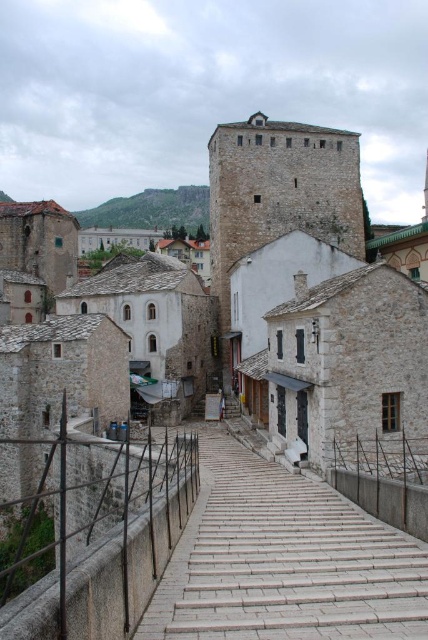
Consider the image. Is white stone tower at center to the right of green stone cliff at upper center from the viewer's perspective?

Indeed, white stone tower at center is positioned on the right side of green stone cliff at upper center.

Is white stone tower at center bigger than green stone cliff at upper center?

No.

Locate an element on the screen. The height and width of the screenshot is (640, 428). white stone tower at center is located at coordinates (278, 196).

Is white stone steps at center bigger than green stone cliff at upper center?

Actually, white stone steps at center might be smaller than green stone cliff at upper center.

The image size is (428, 640). What do you see at coordinates (284, 560) in the screenshot? I see `white stone steps at center` at bounding box center [284, 560].

You are a GUI agent. You are given a task and a screenshot of the screen. Output one action in this format:
    pyautogui.click(x=<x>, y=<y>)
    Task: Click on the white stone steps at center
    The height and width of the screenshot is (640, 428).
    Given the screenshot: What is the action you would take?
    pos(284,560)

Who is more forward, (317,584) or (306,148)?

Point (317,584) is more forward.

Is white stone steps at center in front of white stone tower at center?

Yes, it is.

Does point (220, 520) come behind point (273, 237)?

That is False.

The height and width of the screenshot is (640, 428). Find the location of `white stone steps at center`. white stone steps at center is located at coordinates (284, 560).